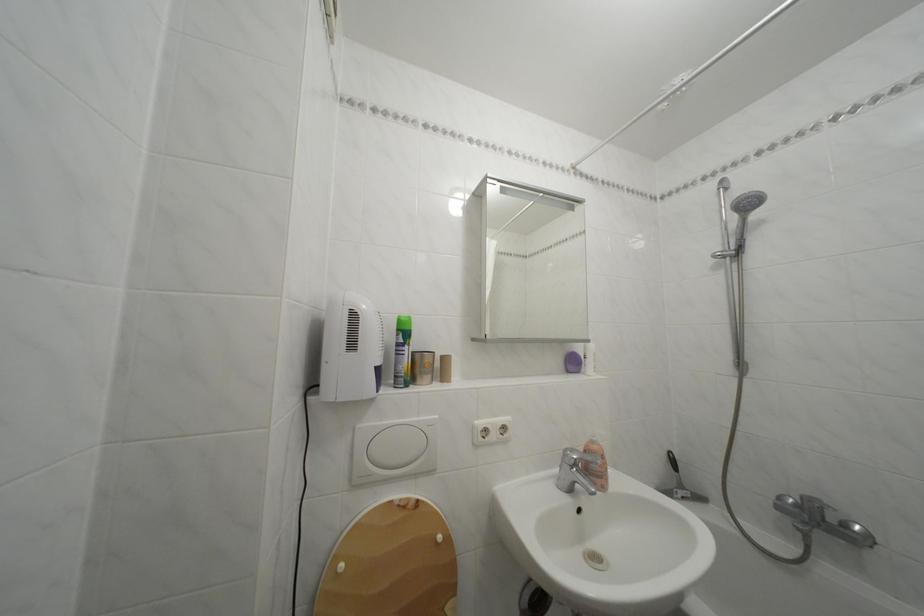
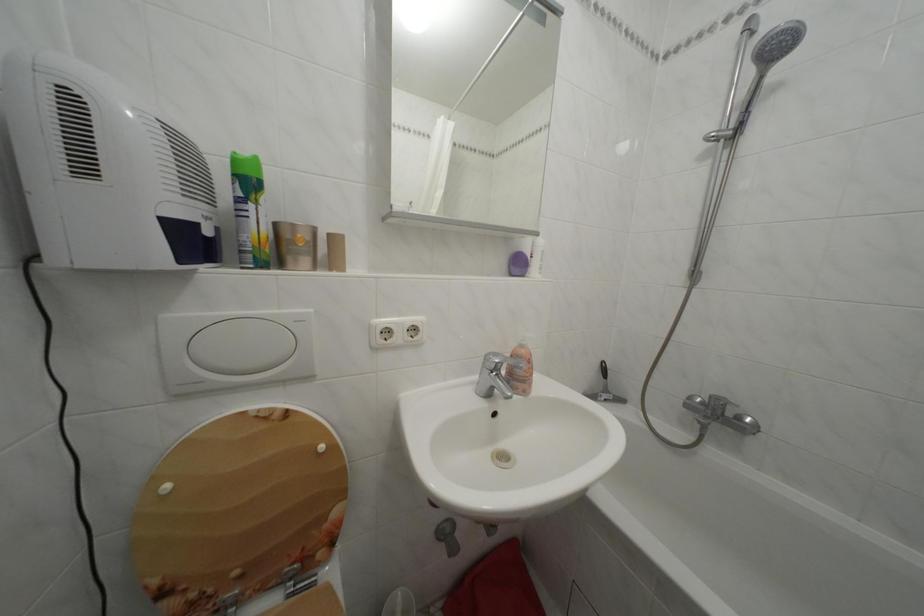
Question: The first image is from the beginning of the video and the second image is from the end. How did the camera likely rotate when shooting the video?

Choices:
 (A) Left
 (B) Right
 (C) Up
 (D) Down

Answer: (D)